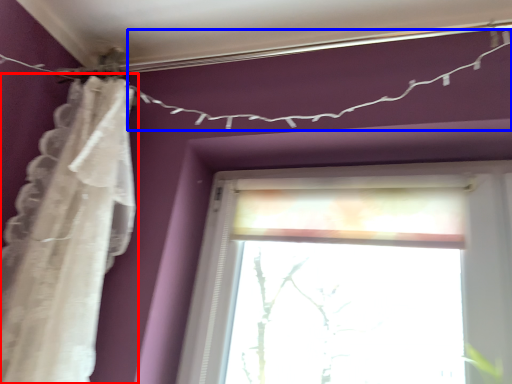
Question: Which object appears farthest to the camera in this image, curtain (highlighted by a red box) or clothesline (highlighted by a blue box)?

Choices:
 (A) curtain
 (B) clothesline

Answer: (B)